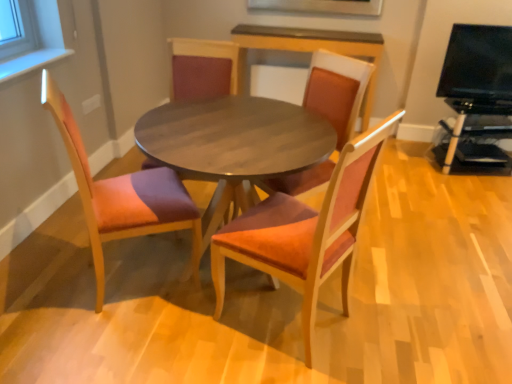
This screenshot has height=384, width=512. What are the coordinates of `vacant space that is to the left of matte wood chair at center, the 2th chair in the right-to-left sequence` in the screenshot? It's located at (175, 342).